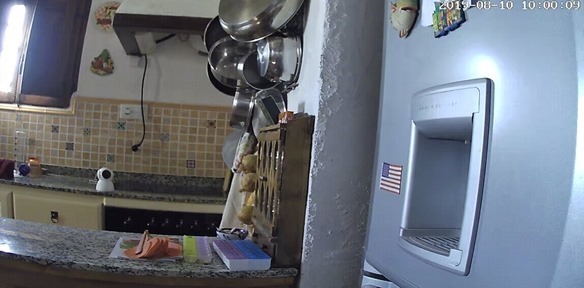
The height and width of the screenshot is (288, 584). What are the coordinates of `pots and pans` in the screenshot? It's located at (270, 112), (280, 63), (278, 20), (244, 55), (220, 60).